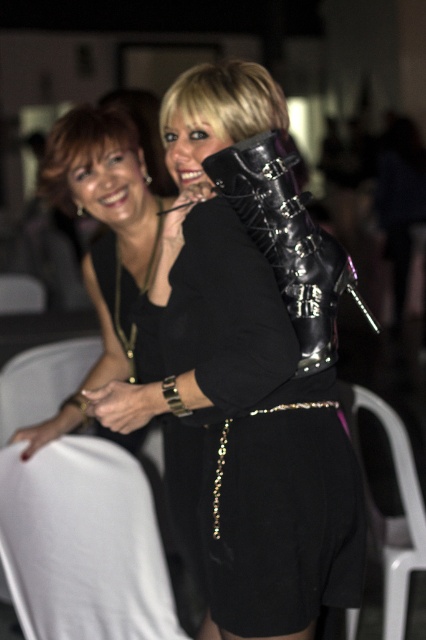
You are a photographer at a gala event. You need to place a small prop exactly at the point with coordinates (259, 436). According to the image provided, which object will this prop be placed on?

The point with coordinates (259, 436) corresponds to the black leather dress at center, so the prop will be placed on the black leather dress at center.